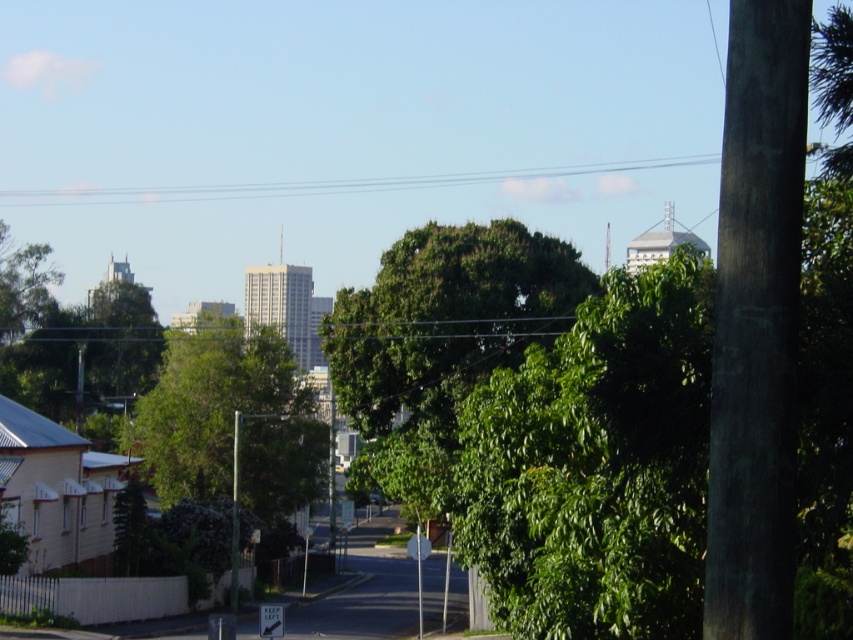
Can you confirm if green leafy tree at center is smaller than white plastic street sign at lower center?

Actually, green leafy tree at center might be larger than white plastic street sign at lower center.

Looking at this image, who is more distant from viewer, (x=178, y=490) or (x=276, y=616)?

The point (x=178, y=490) is behind.

What do you see at coordinates (230, 420) in the screenshot?
I see `green leafy tree at center` at bounding box center [230, 420].

You are a GUI agent. You are given a task and a screenshot of the screen. Output one action in this format:
    pyautogui.click(x=<x>, y=<y>)
    Task: Click on the green leafy tree at center
    The height and width of the screenshot is (640, 853).
    Given the screenshot: What is the action you would take?
    pyautogui.click(x=230, y=420)

Looking at this image, does green leafy tree at center appear on the right side of metallic pole at center?

No, green leafy tree at center is not to the right of metallic pole at center.

Measure the distance between green leafy tree at center and metallic pole at center.

green leafy tree at center is 5.02 meters away from metallic pole at center.

Locate an element on the screen. green leafy tree at center is located at coordinates (230, 420).

Which is behind, point (767, 388) or point (276, 627)?

The point (276, 627) is more distant.

Between dark brown wood pole at right and white plastic street sign at lower center, which one is positioned lower?

white plastic street sign at lower center

Is point (782, 298) positioned in front of point (273, 627)?

Yes.

The image size is (853, 640). Find the location of `dark brown wood pole at right`. dark brown wood pole at right is located at coordinates (756, 323).